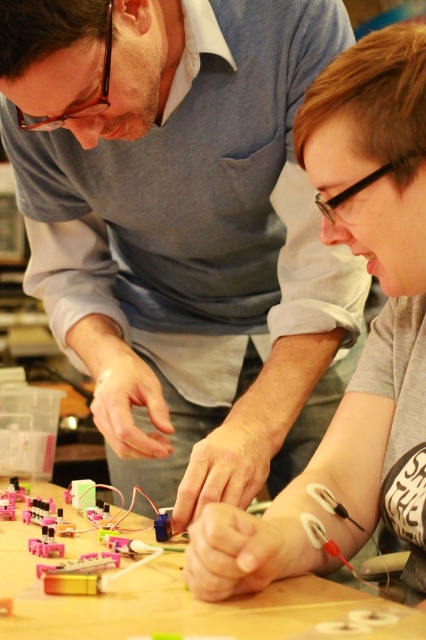
Question: Which of the following is the farthest from the observer?

Choices:
 (A) (178, 410)
 (B) (348, 524)

Answer: (A)

Question: Can you confirm if matte gray sweater at upper left is positioned to the left of gray matte shirt at center?

Choices:
 (A) no
 (B) yes

Answer: (B)

Question: Which of the following is the farthest from the observer?

Choices:
 (A) (345, 248)
 (B) (417, 131)

Answer: (A)

Question: Can you confirm if matte gray sweater at upper left is wider than gray matte shirt at center?

Choices:
 (A) no
 (B) yes

Answer: (B)

Question: Can you confirm if matte gray sweater at upper left is positioned below gray matte shirt at center?

Choices:
 (A) no
 (B) yes

Answer: (A)